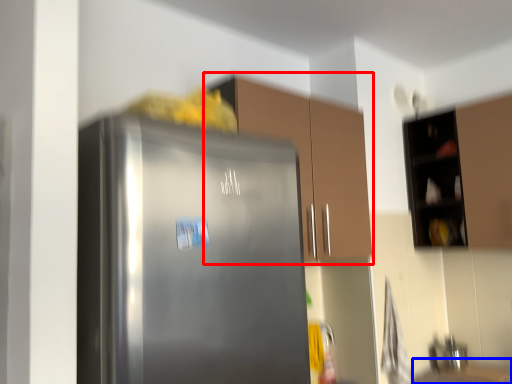
Question: Which of the following is the farthest to the observer, cabinetry (highlighted by a red box) or counter top (highlighted by a blue box)?

Choices:
 (A) cabinetry
 (B) counter top

Answer: (B)